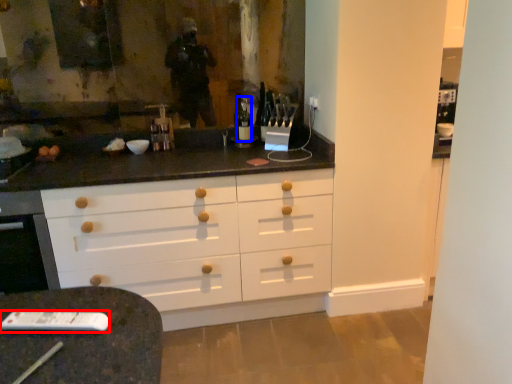
Question: Which object is closer to the camera taking this photo, remote (highlighted by a red box) or bottle (highlighted by a blue box)?

Choices:
 (A) remote
 (B) bottle

Answer: (A)